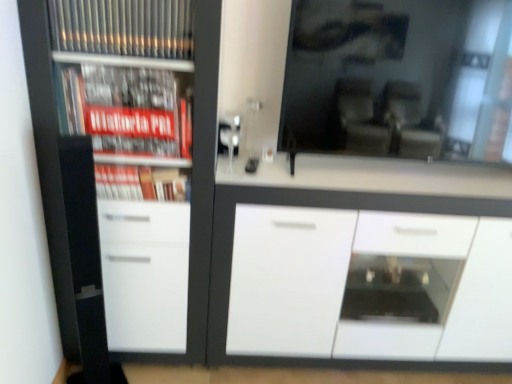
Question: Is white glossy cabinet at center beside white glossy cupboard at left?

Choices:
 (A) no
 (B) yes

Answer: (A)

Question: From the image's perspective, is white glossy cabinet at center over white glossy cupboard at left?

Choices:
 (A) yes
 (B) no

Answer: (B)

Question: Does white glossy cabinet at center come in front of white glossy cupboard at left?

Choices:
 (A) no
 (B) yes

Answer: (A)

Question: Does white glossy cabinet at center appear on the left side of white glossy cupboard at left?

Choices:
 (A) yes
 (B) no

Answer: (B)

Question: Can you confirm if white glossy cabinet at center is bigger than white glossy cupboard at left?

Choices:
 (A) no
 (B) yes

Answer: (B)

Question: In terms of width, does transparent glass mirror at upper center look wider or thinner when compared to white glossy cupboard at left?

Choices:
 (A) wide
 (B) thin

Answer: (B)

Question: Considering the positions of transparent glass mirror at upper center and white glossy cupboard at left in the image, is transparent glass mirror at upper center bigger or smaller than white glossy cupboard at left?

Choices:
 (A) small
 (B) big

Answer: (A)

Question: Is transparent glass mirror at upper center in front of or behind white glossy cupboard at left in the image?

Choices:
 (A) behind
 (B) front

Answer: (A)

Question: From a real-world perspective, is transparent glass mirror at upper center physically located above or below white glossy cupboard at left?

Choices:
 (A) above
 (B) below

Answer: (A)

Question: Is white glossy cabinet at center wider or thinner than transparent glass mirror at upper center?

Choices:
 (A) wide
 (B) thin

Answer: (A)

Question: From a real-world perspective, is white glossy cabinet at center positioned above or below transparent glass mirror at upper center?

Choices:
 (A) above
 (B) below

Answer: (B)

Question: Visually, is white glossy cabinet at center positioned to the left or to the right of transparent glass mirror at upper center?

Choices:
 (A) left
 (B) right

Answer: (A)

Question: In terms of size, does white glossy cabinet at center appear bigger or smaller than transparent glass mirror at upper center?

Choices:
 (A) big
 (B) small

Answer: (A)

Question: Does point (378, 79) appear closer or farther from the camera than point (361, 254)?

Choices:
 (A) closer
 (B) farther

Answer: (A)

Question: From a real-world perspective, is transparent glass mirror at upper center physically located above or below white glossy cabinet at center?

Choices:
 (A) above
 (B) below

Answer: (A)